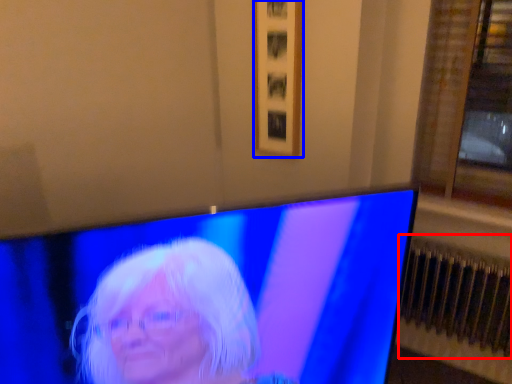
Question: Among these objects, which one is farthest to the camera, radiator (highlighted by a red box) or picture frame (highlighted by a blue box)?

Choices:
 (A) radiator
 (B) picture frame

Answer: (B)